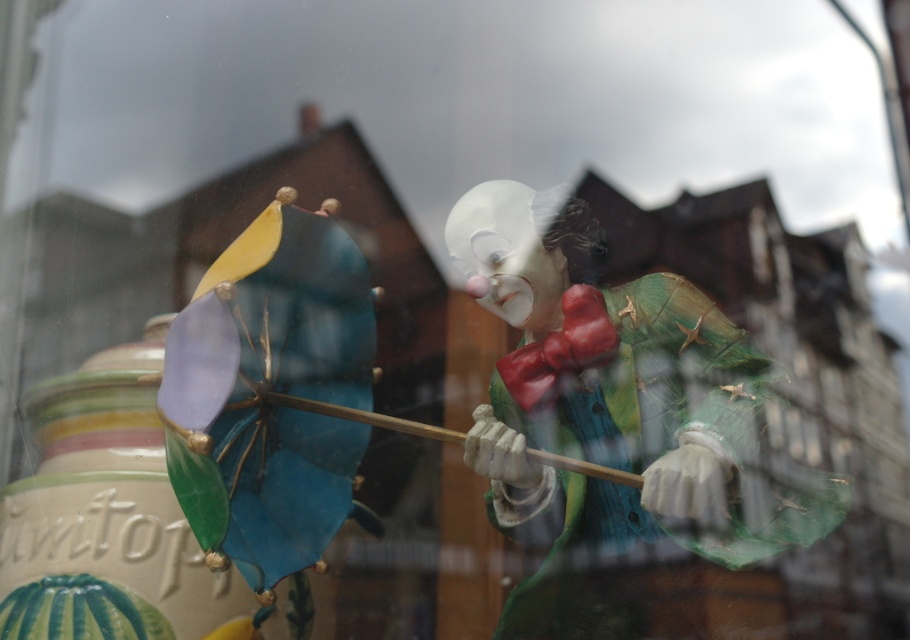
Question: Is matte porcelain clown at center positioned behind matte white clown nose at center?

Choices:
 (A) no
 (B) yes

Answer: (A)

Question: Which point appears farthest from the camera in this image?

Choices:
 (A) (472, 204)
 (B) (483, 291)

Answer: (A)

Question: Among these objects, which one is farthest from the camera?

Choices:
 (A) matte white clown nose at center
 (B) matte porcelain clown at center

Answer: (A)

Question: Can you confirm if matte porcelain clown at center is positioned to the right of matte white clown nose at center?

Choices:
 (A) yes
 (B) no

Answer: (A)

Question: Can you confirm if matte porcelain clown at center is bigger than matte white clown nose at center?

Choices:
 (A) no
 (B) yes

Answer: (B)

Question: Among these points, which one is farthest from the camera?

Choices:
 (A) (627, 468)
 (B) (476, 278)

Answer: (B)